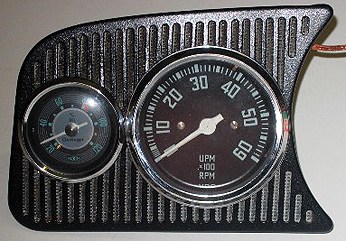
The width and height of the screenshot is (346, 241). Find the location of `panel`. panel is located at coordinates (120, 179).